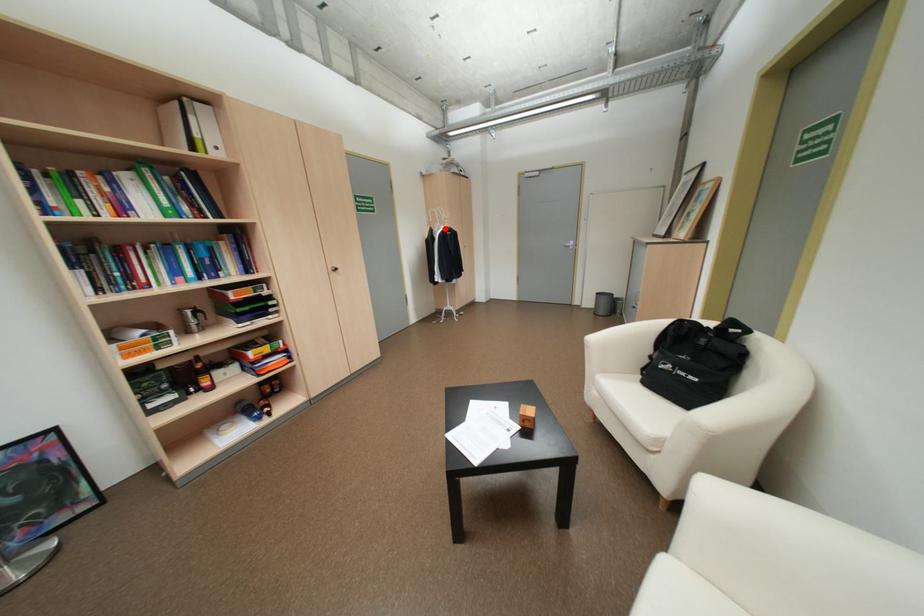
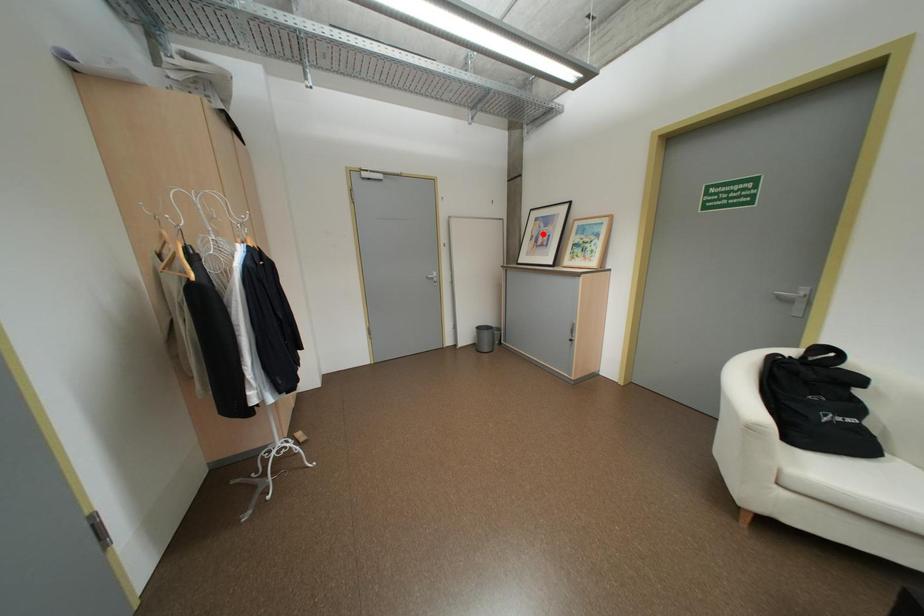
I am providing you with two images of the same scene from different viewpoints. A red point is marked on the first image and another point is marked on the second image. Do the highlighted points in image1 and image2 indicate the same real-world spot?

No